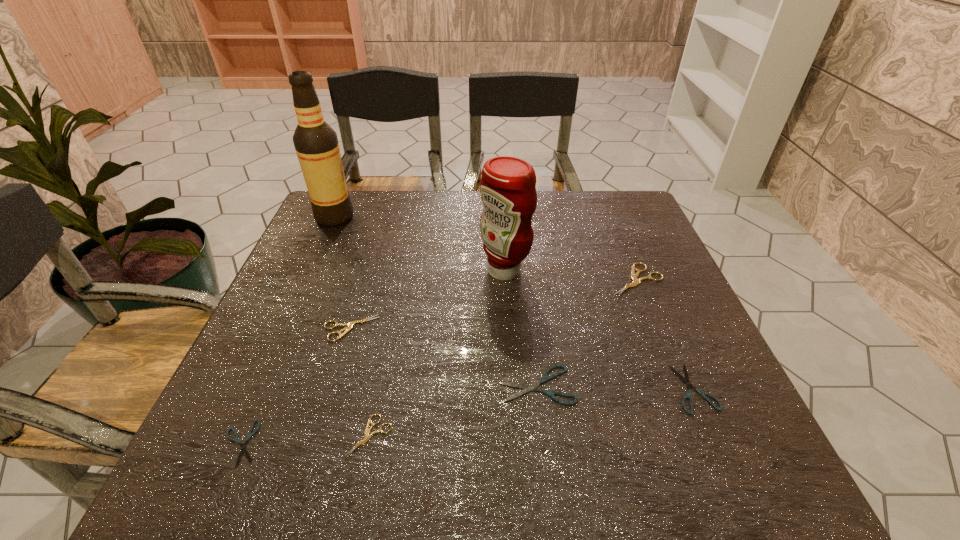
At what (x,y) coordinates should I click in order to perform the action: click on the nearest beige shears. Please return your answer as a coordinate pair (x, y). The image size is (960, 540). Looking at the image, I should click on (367, 436).

Find the location of a particular element. the rightmost black shears is located at coordinates (688, 395).

Where is `the nearest black shears`? Image resolution: width=960 pixels, height=540 pixels. the nearest black shears is located at coordinates (243, 446).

At what (x,y) coordinates should I click in order to perform the action: click on the shortest shears. Please return your answer as a coordinate pair (x, y). This screenshot has height=540, width=960. Looking at the image, I should click on (243, 446).

Identify the location of blank area located on the label of the farthest object. The width and height of the screenshot is (960, 540). (422, 217).

This screenshot has width=960, height=540. Identify the location of free space located 0.230m on the right of the condiment. (620, 271).

This screenshot has width=960, height=540. I want to click on vacant space located 0.210m on the back of the third tallest object, so click(612, 218).

At what (x,y) coordinates should I click in order to perform the action: click on free space located 0.350m on the back of the fifth nearest object. Please return your answer as a coordinate pair (x, y). The width and height of the screenshot is (960, 540). Looking at the image, I should click on (381, 227).

You are a GUI agent. You are given a task and a screenshot of the screen. Output one action in this format:
    pyautogui.click(x=<x>, y=<y>)
    Task: Click on the free space located on the left of the second black shears from right to left
    This screenshot has height=540, width=960.
    Given the screenshot: What is the action you would take?
    pyautogui.click(x=402, y=384)

You are a GUI agent. You are given a task and a screenshot of the screen. Output one action in this format:
    pyautogui.click(x=<x>, y=<y>)
    Task: Click on the vacant point located on the left of the smallest beige shears
    The height and width of the screenshot is (540, 960).
    Given the screenshot: What is the action you would take?
    pyautogui.click(x=241, y=436)